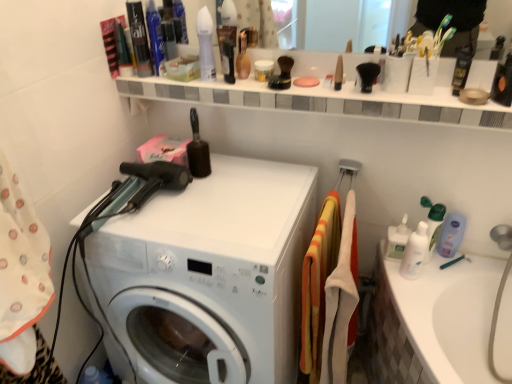
You are a GUI agent. You are given a task and a screenshot of the screen. Output one action in this format:
    pyautogui.click(x=<x>, y=<y>)
    Task: Click on the free space to the left of black matte hair gel at upper right, the 2th toiletry ordered from the bottom
    
    Given the screenshot: What is the action you would take?
    pyautogui.click(x=413, y=100)